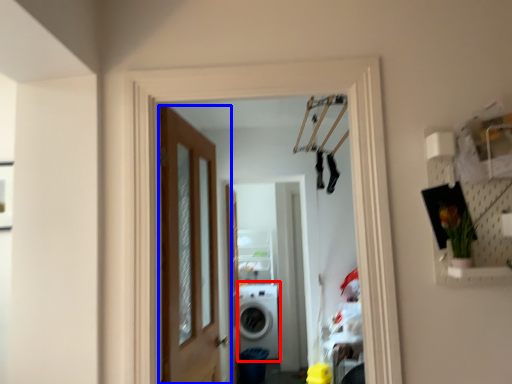
Question: Which object is closer to the camera taking this photo, washing machine (highlighted by a red box) or door (highlighted by a blue box)?

Choices:
 (A) washing machine
 (B) door

Answer: (B)